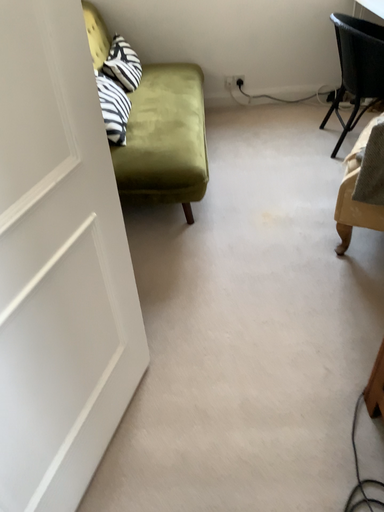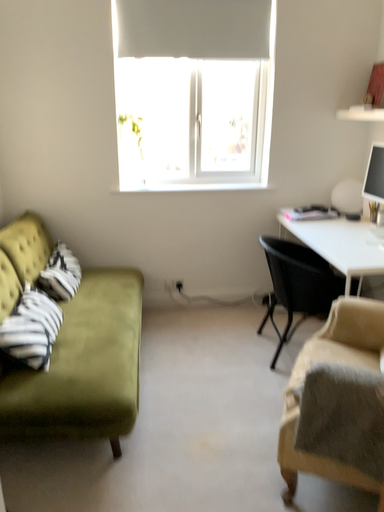
Question: How did the camera likely rotate when shooting the video?

Choices:
 (A) rotated right
 (B) rotated left

Answer: (A)